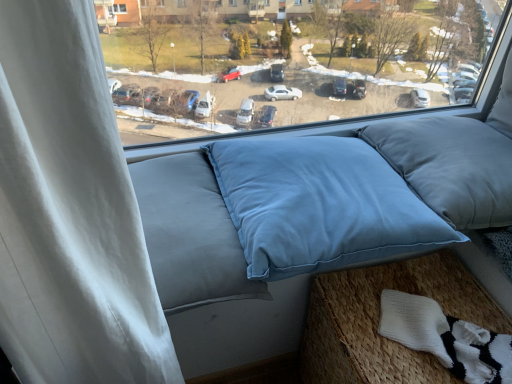
Question: Is satin blue pillow at center, the second pillow when ordered from left to right, in front of or behind blue fabric pillow at center, which appears as the 2th pillow when viewed from the right, in the image?

Choices:
 (A) front
 (B) behind

Answer: (B)

Question: From their relative heights in the image, would you say satin blue pillow at center, the second pillow when ordered from left to right, is taller or shorter than blue fabric pillow at center, which appears as the 2th pillow when viewed from the right?

Choices:
 (A) tall
 (B) short

Answer: (B)

Question: Which is nearer to the white knitted socks at lower right?

Choices:
 (A) light blue fabric cushion at lower right
 (B) satin blue pillow at center, the second pillow when ordered from left to right
 (C) blue fabric pillow at center, the first pillow from the left
 (D) blue fabric pillows at center

Answer: (A)

Question: Estimate the real-world distances between objects in this image. Which object is closer to the blue fabric pillow at center, the first pillow from the left?

Choices:
 (A) white knitted socks at lower right
 (B) satin blue pillow at center, acting as the 1th pillow starting from the right
 (C) blue fabric pillows at center
 (D) light blue fabric cushion at lower right

Answer: (B)